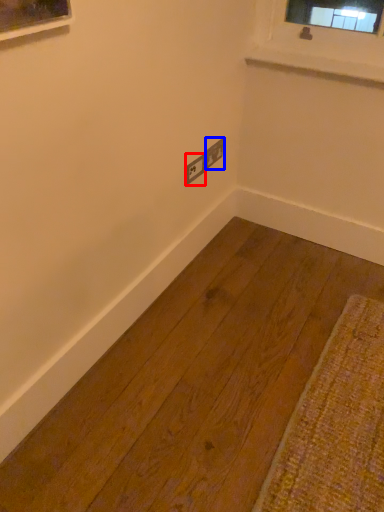
Question: Which of the following is the farthest to the observer, electric outlet (highlighted by a red box) or electric outlet (highlighted by a blue box)?

Choices:
 (A) electric outlet
 (B) electric outlet

Answer: (B)